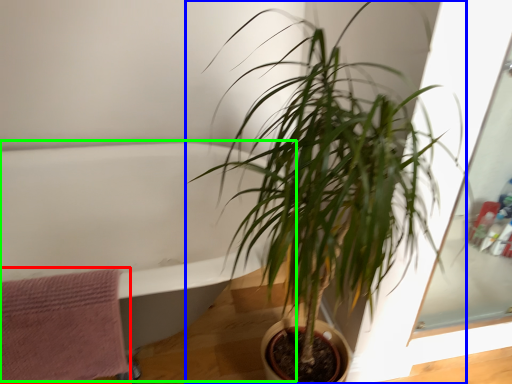
Question: Which object is positioned farthest from bath towel (highlighted by a red box)? Select from houseplant (highlighted by a blue box) and bath (highlighted by a green box).

Choices:
 (A) houseplant
 (B) bath

Answer: (A)